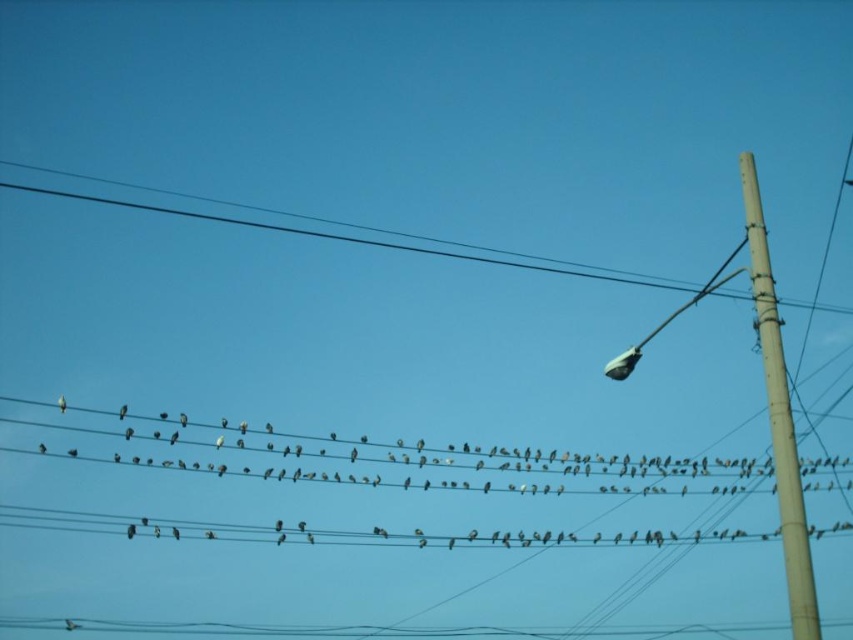
Question: Does white matte bird at center appear on the left side of gray matte bird at center?

Choices:
 (A) yes
 (B) no

Answer: (B)

Question: Does white matte bird at center appear on the left side of gray matte bird at center?

Choices:
 (A) yes
 (B) no

Answer: (B)

Question: Which object appears farthest from the camera in this image?

Choices:
 (A) gray matte bird at center
 (B) smooth beige pole at right

Answer: (A)

Question: Among these objects, which one is farthest from the camera?

Choices:
 (A) white matte bird at center
 (B) white feathered bird at left
 (C) smooth beige pole at right
 (D) gray matte bird at center

Answer: (D)

Question: Which object appears closest to the camera in this image?

Choices:
 (A) smooth beige pole at right
 (B) white feathered bird at left
 (C) gray matte bird at center
 (D) white matte bird at center

Answer: (D)

Question: Considering the relative positions of white matte bird at center and smooth beige pole at right in the image provided, where is white matte bird at center located with respect to smooth beige pole at right?

Choices:
 (A) right
 (B) left

Answer: (B)